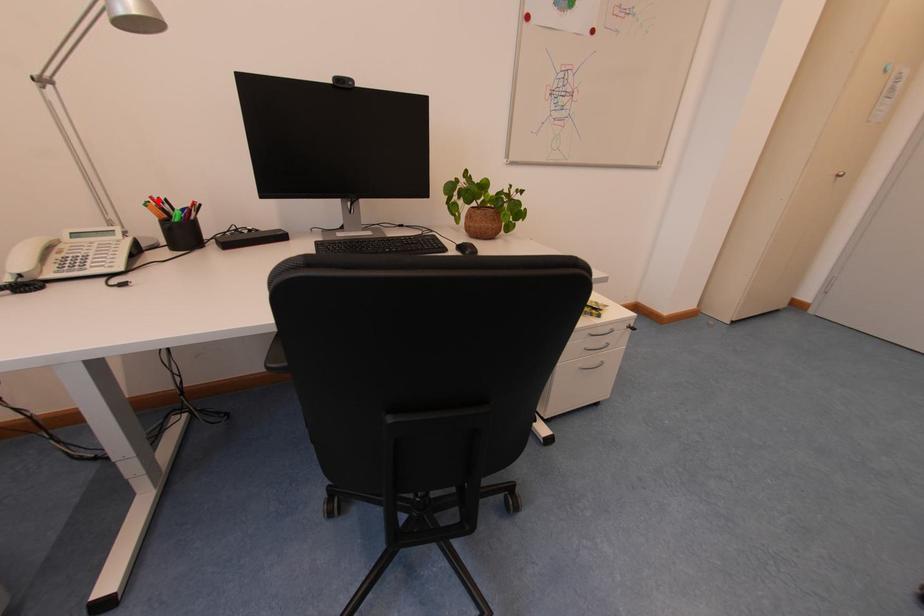
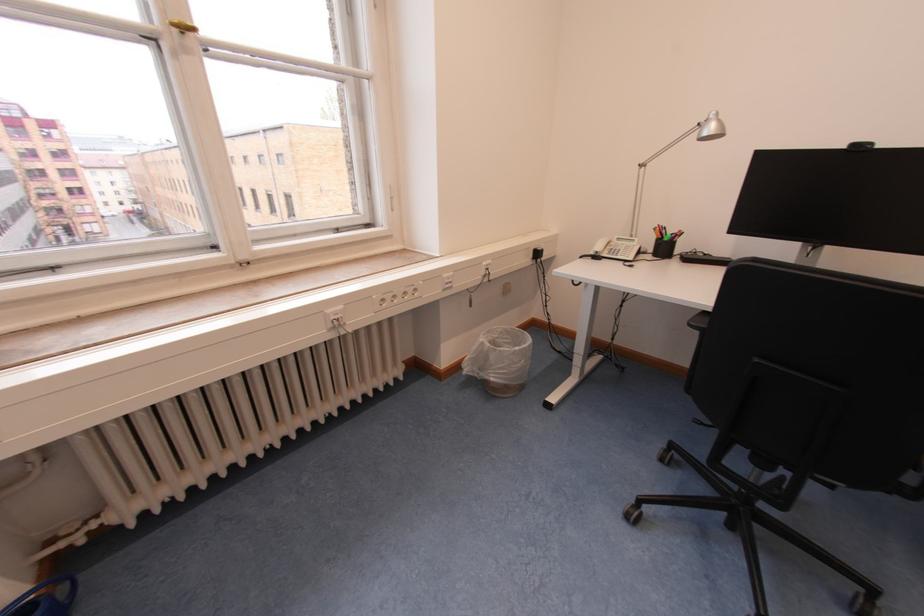
In the second image, find the point that corresponds to the highlighted location in the first image.

(665, 228)